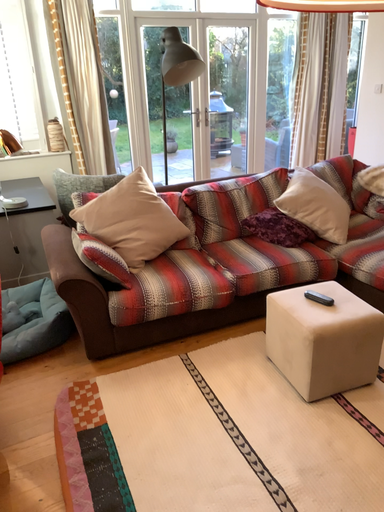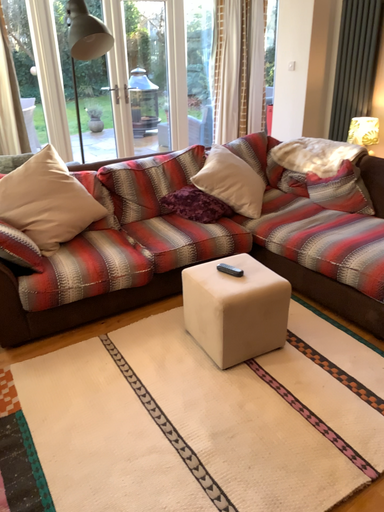
Question: Which way did the camera rotate in the video?

Choices:
 (A) rotated right
 (B) rotated left

Answer: (A)